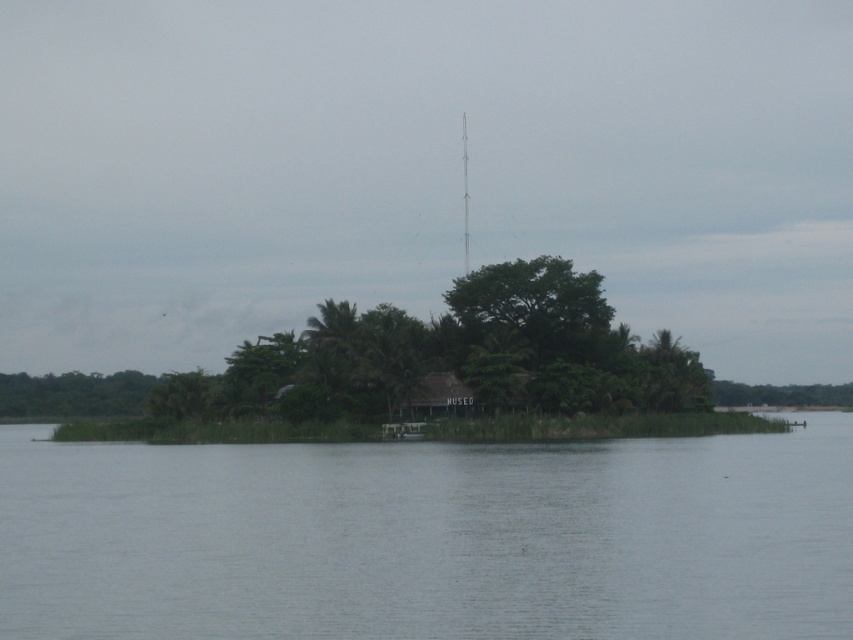
You are a tourist planning to visit the MUSEO on the island. You see the clear water at center and the brown thatched hut at center. Which one is taller?

The clear water at center is much taller than the brown thatched hut at center.

You are a visitor on the island and want to take a photo of the brown thatched hut at center. However, you notice the green leafy tree at center is blocking your view. Can you determine if the tree is closer to you than the hut?

The green leafy tree at center is further to the viewer than brown thatched hut at center, so the tree is actually behind the hut and not blocking the view. You can take the photo without any obstruction.

You are a visitor on the island and want to take a photo of the green leafy tree at center and the clear water at center. Where should you position yourself to capture both in the frame?

To capture both the green leafy tree at center and the clear water at center in the frame, position yourself so that the green leafy tree at center is above the clear water at center, as the clear water at center is located below the green leafy tree at center.